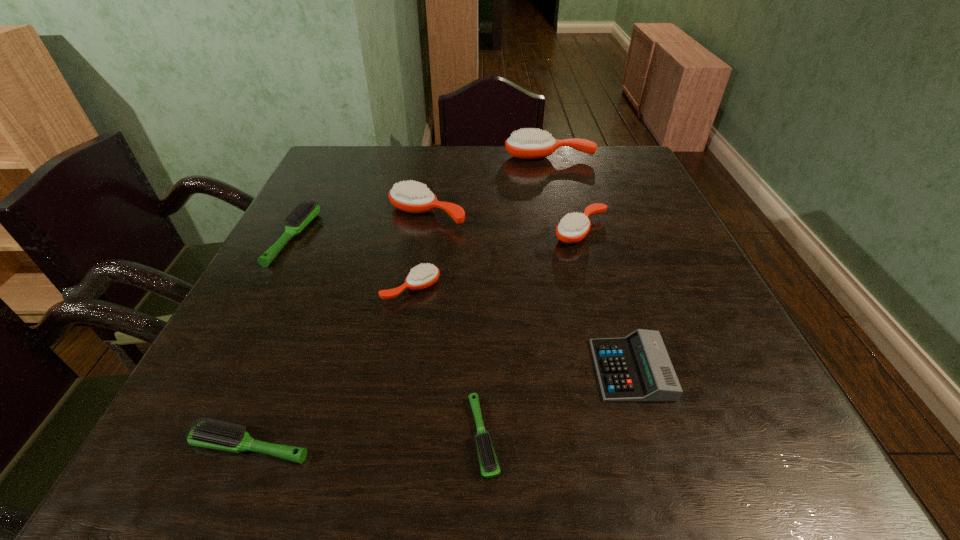
Locate an element on the screen. the second biggest light hairbrush is located at coordinates (210, 434).

The image size is (960, 540). I want to click on the shortest hairbrush, so click(490, 468).

Identify the location of the shortest object. (490, 468).

The width and height of the screenshot is (960, 540). Identify the location of vacant space located 0.080m on the left of the biggest orange hairbrush. (478, 156).

The width and height of the screenshot is (960, 540). I want to click on vacant space located 0.370m on the front of the third smallest orange hairbrush, so click(x=405, y=355).

Where is `free space located on the right of the sixth shortest object`? free space located on the right of the sixth shortest object is located at coordinates (643, 231).

Locate an element on the screen. This screenshot has width=960, height=540. vacant position located on the front of the biggest light hairbrush is located at coordinates (264, 294).

At what (x,y) coordinates should I click in order to perform the action: click on free space located 0.050m on the front of the fifth farthest hairbrush. Please return your answer as a coordinate pair (x, y). Image resolution: width=960 pixels, height=540 pixels. Looking at the image, I should click on (405, 323).

Image resolution: width=960 pixels, height=540 pixels. What are the coordinates of `vacant area situated on the back of the gray calculator` in the screenshot? It's located at (603, 279).

Find the location of a particular element. This screenshot has width=960, height=540. blank space located on the right of the second shortest hairbrush is located at coordinates (565, 446).